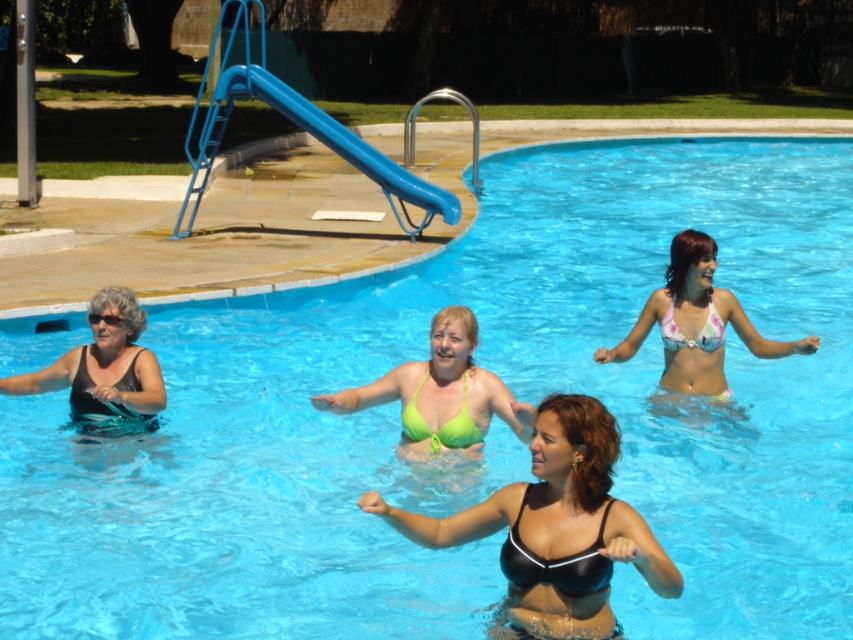
Does floral bikini at center have a smaller size compared to black matte bikini top at center?

No, floral bikini at center is not smaller than black matte bikini top at center.

Does floral bikini at center have a greater height compared to black matte bikini top at center?

Correct, floral bikini at center is much taller as black matte bikini top at center.

Locate an element on the screen. floral bikini at center is located at coordinates (695, 324).

Does green bikini top at center have a greater width compared to black matte swimsuit at left?

Yes.

Does point (524, 435) come farther from viewer compared to point (120, 384)?

No, (524, 435) is closer to viewer.

The image size is (853, 640). What are the coordinates of `green bikini top at center` in the screenshot? It's located at (440, 394).

From the picture: Can you confirm if black matte bikini top at center is shorter than green matte bikini top at center?

Indeed, black matte bikini top at center has a lesser height compared to green matte bikini top at center.

What do you see at coordinates (555, 561) in the screenshot? I see `black matte bikini top at center` at bounding box center [555, 561].

I want to click on black matte bikini top at center, so click(555, 561).